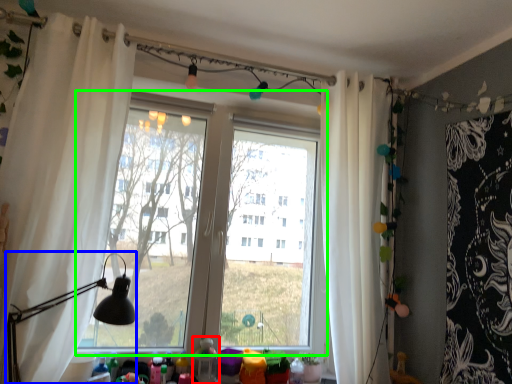
Question: Which object is the farthest from toy (highlighted by a red box)? Choose among these: table lamp (highlighted by a blue box) or window (highlighted by a green box).

Choices:
 (A) table lamp
 (B) window

Answer: (B)